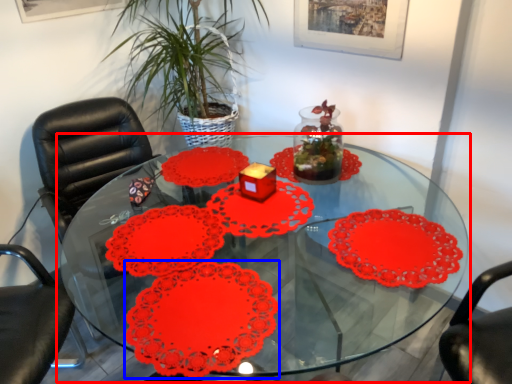
Question: Among these objects, which one is nearest to the camera, table (highlighted by a red box) or flower (highlighted by a blue box)?

Choices:
 (A) table
 (B) flower

Answer: (A)